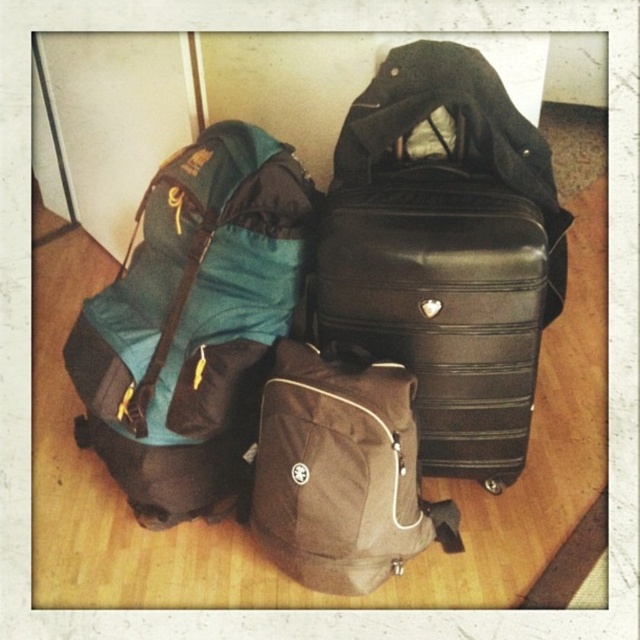
At what (x,y) coordinates should I click in order to perform the action: click on teal fabric backpack at left. Please return your answer as a coordinate pair (x, y). This screenshot has height=640, width=640. Looking at the image, I should click on 193,323.

Is point (221, 384) closer to viewer compared to point (428, 348)?

Yes.

Where is `teal fabric backpack at left`? The width and height of the screenshot is (640, 640). teal fabric backpack at left is located at coordinates (193, 323).

Does black hardshell suitcase at center have a larger size compared to brown fabric backpack at center?

Correct, black hardshell suitcase at center is larger in size than brown fabric backpack at center.

Between point (403, 221) and point (339, 506), which one is positioned behind?

The point (403, 221) is more distant.

Which is behind, point (529, 432) or point (394, 412)?

The point (529, 432) is behind.

Find the location of `black hardshell suitcase at center`. black hardshell suitcase at center is located at coordinates [440, 298].

Between teal fabric backpack at left and brown fabric backpack at center, which one has less height?

brown fabric backpack at center

Who is lower down, teal fabric backpack at left or brown fabric backpack at center?

brown fabric backpack at center

Which is in front, point (118, 314) or point (262, 518)?

Point (262, 518) is in front.

Where is `teal fabric backpack at left`? This screenshot has width=640, height=640. teal fabric backpack at left is located at coordinates (193, 323).